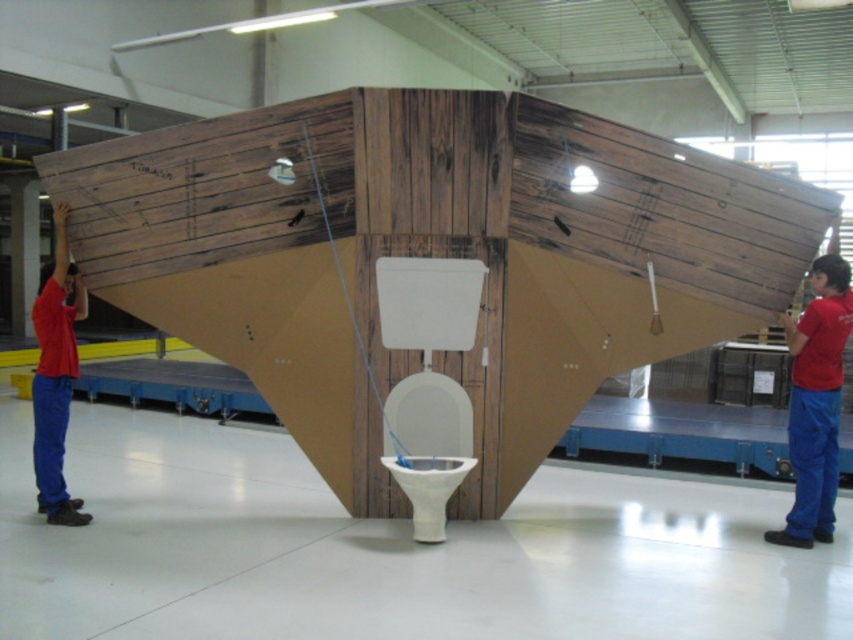
Is red cotton shirt at center below matte red shirt at left?

Correct, red cotton shirt at center is located below matte red shirt at left.

Can you confirm if red cotton shirt at center is shorter than matte red shirt at left?

Correct, red cotton shirt at center is not as tall as matte red shirt at left.

Which is in front, point (805, 360) or point (74, 372)?

Point (805, 360)

At what (x,y) coordinates should I click in order to perform the action: click on red cotton shirt at center. Please return your answer as a coordinate pair (x, y). This screenshot has width=853, height=640. Looking at the image, I should click on (816, 403).